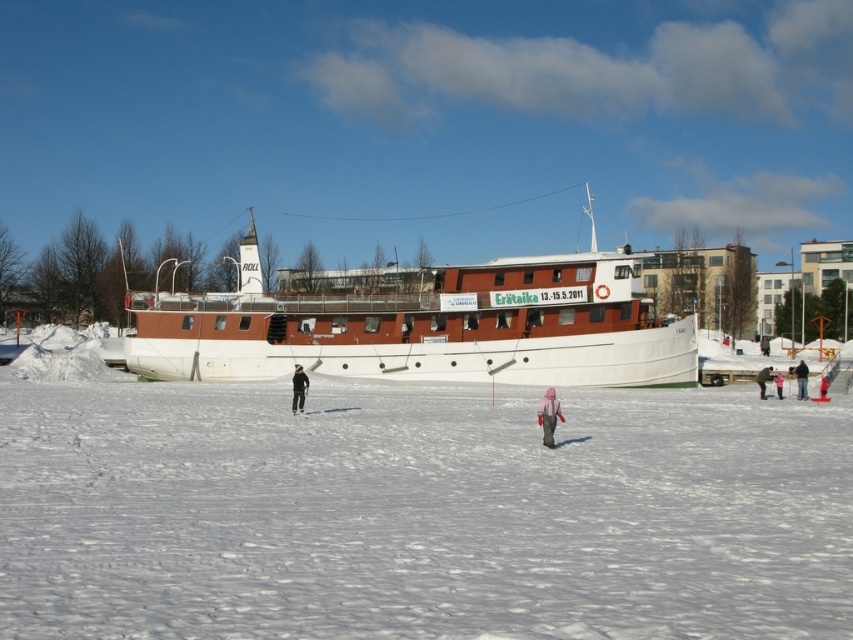
Does point (795, 369) lie in front of point (779, 392)?

No, it is behind (779, 392).

You are a GUI agent. You are given a task and a screenshot of the screen. Output one action in this format:
    pyautogui.click(x=<x>, y=<y>)
    Task: Click on the dark gray jacket at lower right
    This screenshot has height=640, width=853.
    Given the screenshot: What is the action you would take?
    click(x=801, y=380)

Who is more distant from viewer, (799,368) or (778,376)?

The point (799,368) is more distant.

Image resolution: width=853 pixels, height=640 pixels. Find the location of `dark gray jacket at lower right`. dark gray jacket at lower right is located at coordinates (801, 380).

What are the coordinates of `white powdery snow at center` in the screenshot? It's located at (421, 513).

Who is shorter, white powdery snow at center or matte black jacket at center?

With less height is matte black jacket at center.

Does point (682, 586) come behind point (819, 396)?

No.

At what (x,y) coordinates should I click in order to perform the action: click on white powdery snow at center. Please return your answer as a coordinate pair (x, y). This screenshot has height=640, width=853. Looking at the image, I should click on coord(421,513).

From the picture: Does black matte jacket at center have a smaller size compared to matte black jacket at center?

No.

Can you confirm if black matte jacket at center is bigger than matte black jacket at center?

Yes.

Is point (305, 392) closer to viewer compared to point (819, 396)?

Yes, point (305, 392) is in front of point (819, 396).

Image resolution: width=853 pixels, height=640 pixels. In order to click on black matte jacket at center in this screenshot , I will do `click(299, 388)`.